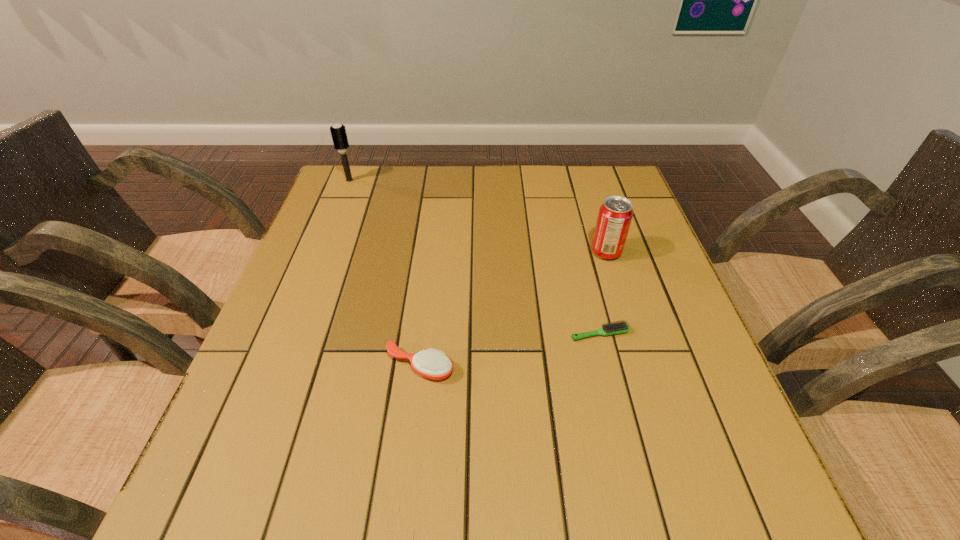
At what (x,y) coordinates should I click in order to perform the action: click on the farthest object. Please return your answer as a coordinate pair (x, y). This screenshot has height=540, width=960. Looking at the image, I should click on (338, 132).

You are a GUI agent. You are given a task and a screenshot of the screen. Output one action in this format:
    pyautogui.click(x=<x>, y=<y>)
    Task: Click on the farthest hairbrush
    This screenshot has width=960, height=540.
    Given the screenshot: What is the action you would take?
    pyautogui.click(x=338, y=132)

This screenshot has width=960, height=540. In order to click on the third shortest object in this screenshot , I will do `click(615, 215)`.

Identify the location of the second farthest object. The height and width of the screenshot is (540, 960). (615, 215).

At what (x,y) coordinates should I click in order to perform the action: click on the second shortest object. Please return your answer as a coordinate pair (x, y). Image resolution: width=960 pixels, height=540 pixels. Looking at the image, I should click on (431, 364).

At what (x,y) coordinates should I click in order to perform the action: click on the second object from left to right. Please return your answer as a coordinate pair (x, y). The image size is (960, 540). Looking at the image, I should click on (431, 364).

In order to click on the shortest hairbrush in this screenshot , I will do `click(615, 328)`.

The width and height of the screenshot is (960, 540). Identify the location of the shortest object. (615, 328).

Locate an element on the screen. vacant space located on the front of the tallest hairbrush is located at coordinates (324, 244).

Where is `free space located on the front of the third shortest object`? This screenshot has height=540, width=960. free space located on the front of the third shortest object is located at coordinates (628, 323).